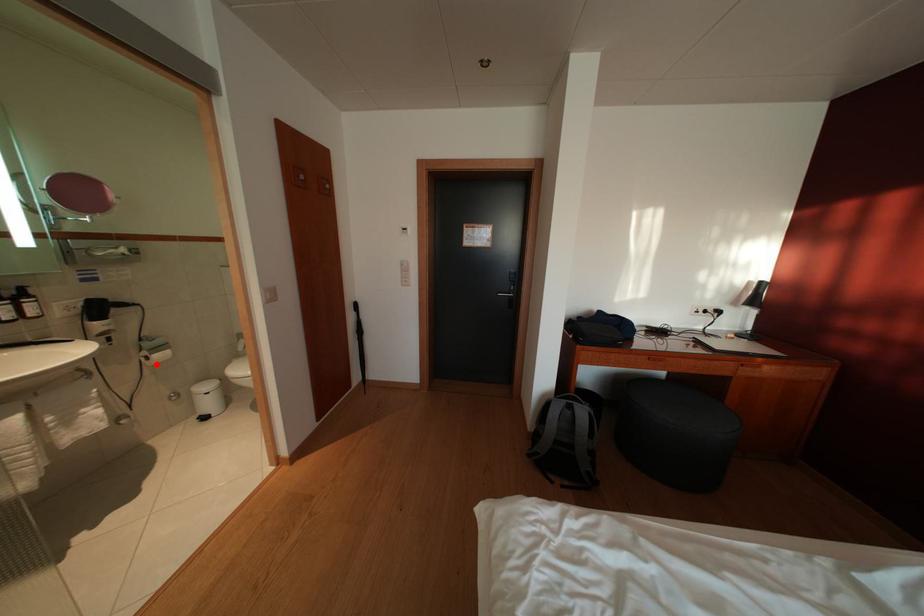
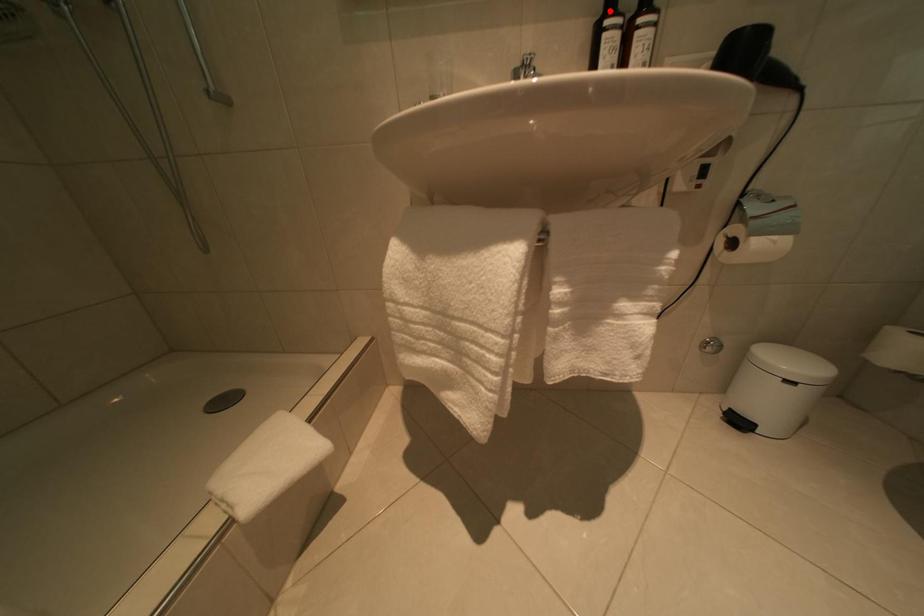
I am providing you with two images of the same scene from different viewpoints. A red point is marked on the first image and another point is marked on the second image. Are the points marked in image1 and image2 representing the same 3D position?

No